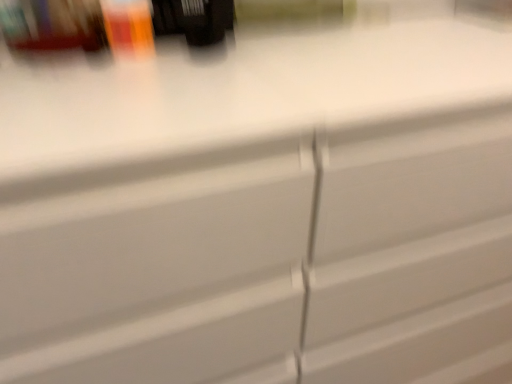
Find the location of a particular element. The height and width of the screenshot is (384, 512). vacant region in front of matte plastic beverage at upper left is located at coordinates (104, 102).